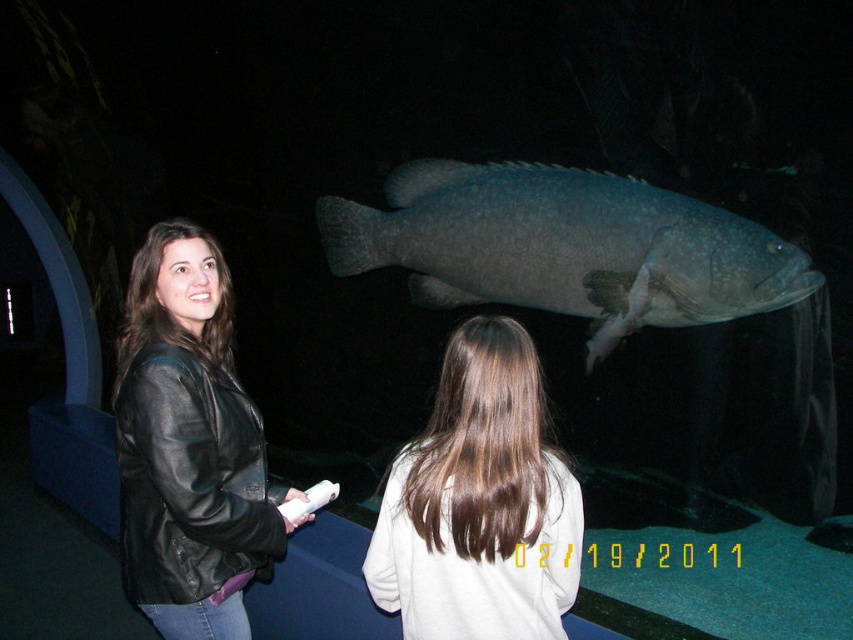
You are standing in the aquarium exhibit and notice the gray textured fish at center and the smooth brown hair at center. Which object is positioned higher in the image?

The gray textured fish at center is positioned higher than the smooth brown hair at center in the image.

You are a photographer trying to capture a photo of the gray textured fish at center and the black leather jacket at left. Based on their sizes, which object should you focus on first if you want to ensure both are in the frame without cropping?

The gray textured fish at center is wider than the black leather jacket at left, so you should focus on the gray textured fish at center first to ensure it fits in the frame, then adjust to include the black leather jacket at left.

You are an observer standing in front of the aquarium. You see the black leather jacket at left and the smooth brown hair at center. Which object is wider?

The black leather jacket at left is wider than the smooth brown hair at center according to the description.